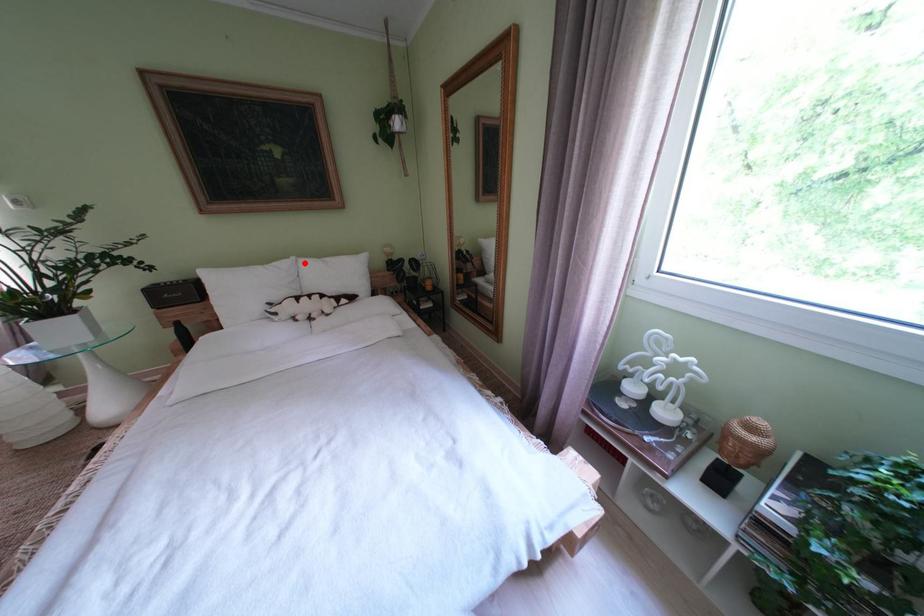
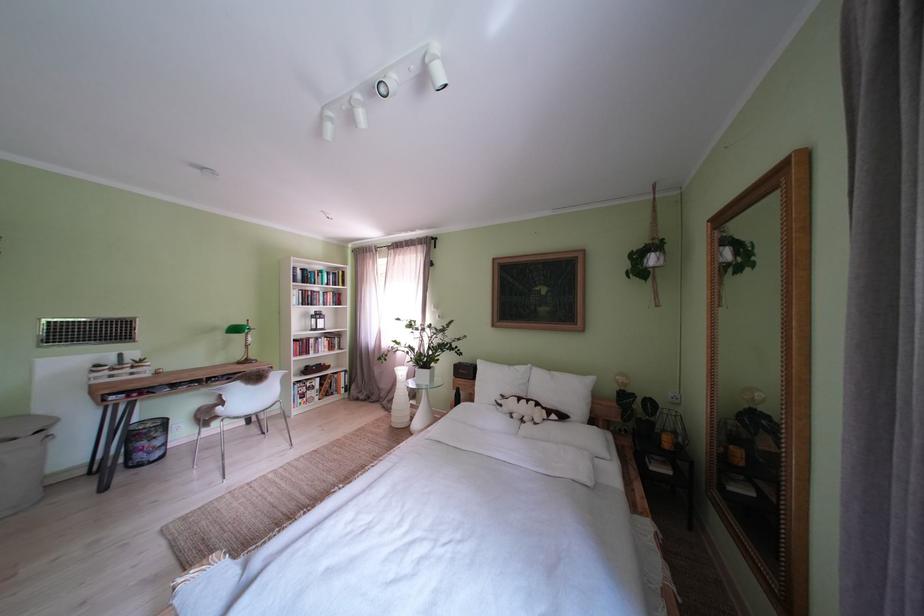
Where in the second image is the point corresponding to the highlighted location from the first image?

(541, 371)